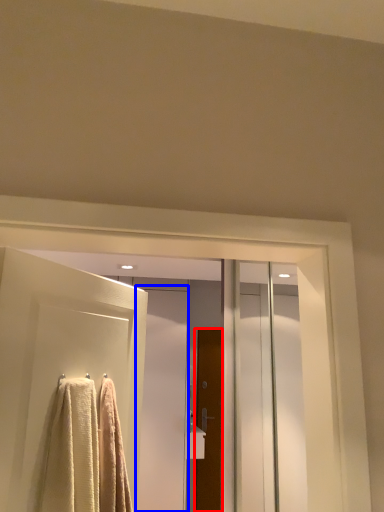
Question: Which object appears closest to the camera in this image, door (highlighted by a red box) or screen door (highlighted by a blue box)?

Choices:
 (A) door
 (B) screen door

Answer: (B)